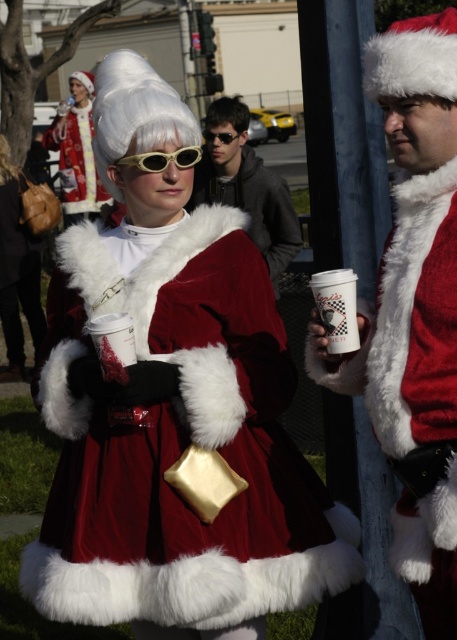
You are organizing a Christmas party and need to arrange the velvet santa coat at center and the white fuzzy wig at center on a display rack. If the rack has limited space, which item should you place first to ensure both fit?

The velvet santa coat at center is larger than the white fuzzy wig at center, so you should place the velvet santa coat at center first to accommodate its size, then the white fuzzy wig at center.

Based on the photo, you are a photographer trying to capture a clear shot of both the velvet santa coat at center and the white fuzzy wig at center. Based on their positions, which one should you focus on first to ensure it appears sharp in the photo?

The velvet santa coat at center is below the white fuzzy wig at center, so you should focus on the white fuzzy wig at center first to ensure both appear sharp as you adjust the camera settings.

You are a photographer trying to capture a photo of the yellowmattegoggles at center and the white fluffy wig at center. Which object should you focus on first if you want to ensure both are in focus, considering their heights?

The yellowmattegoggles at center is shorter than the white fluffy wig at center, so you should focus on the white fluffy wig at center first to ensure both are in focus.